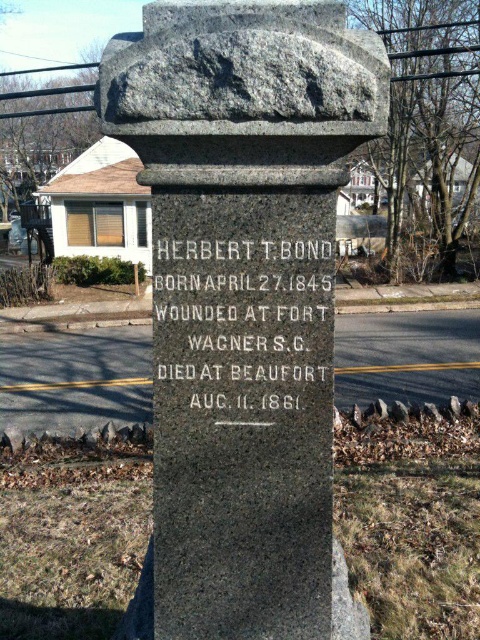
Is point (259, 116) closer to viewer compared to point (197, 266)?

That is True.

This screenshot has width=480, height=640. What do you see at coordinates (242, 294) in the screenshot? I see `granite stone monument at center` at bounding box center [242, 294].

I want to click on granite stone monument at center, so click(x=242, y=294).